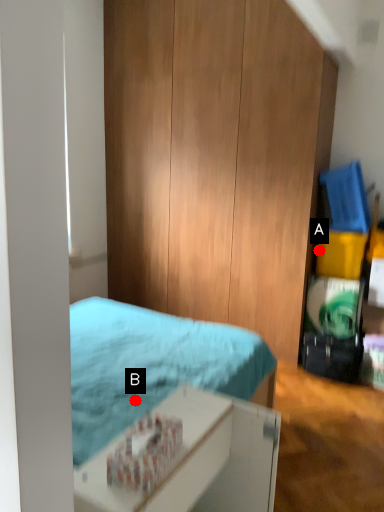
Question: Two points are circled on the image, labeled by A and B beside each circle. Which point is closer to the camera?

Choices:
 (A) A is closer
 (B) B is closer

Answer: (B)